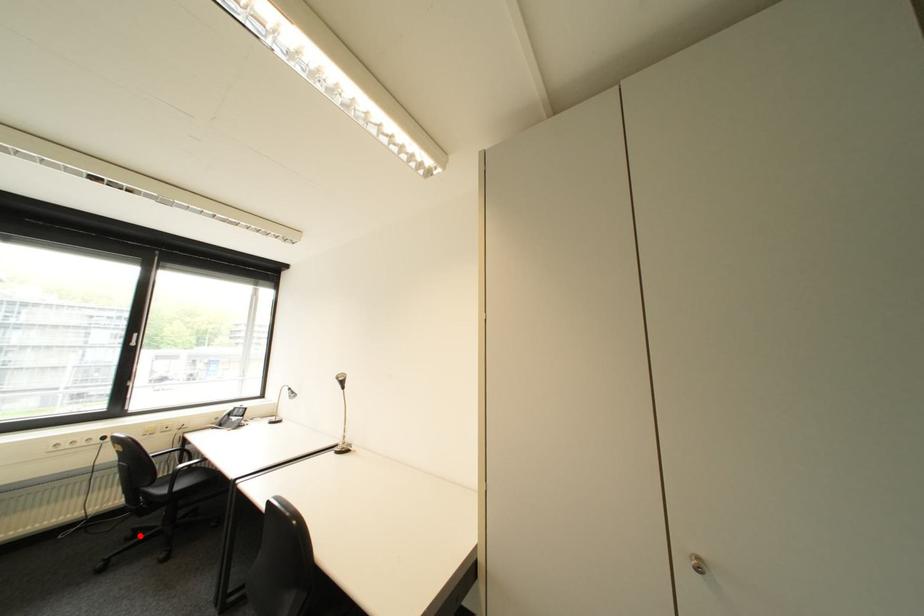
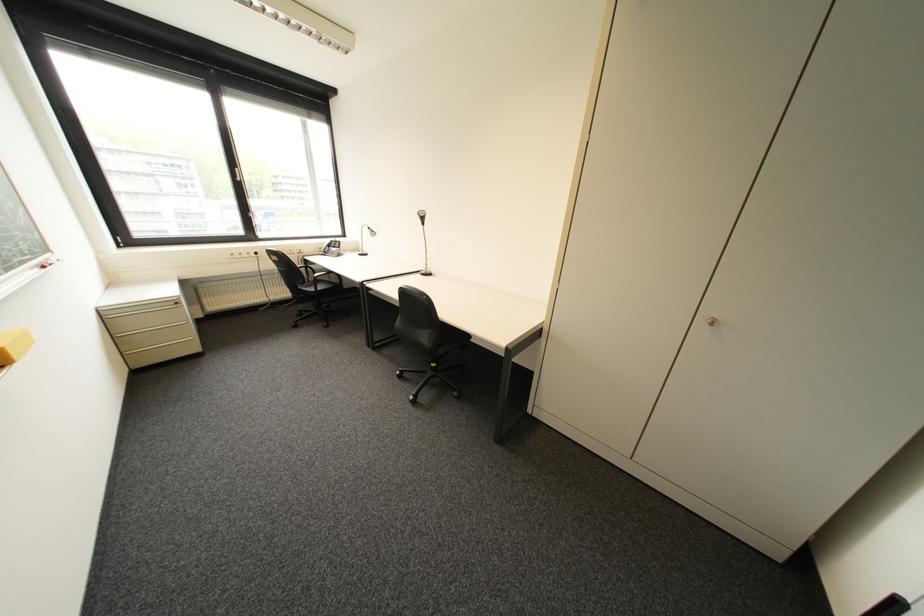
In the second image, find the point that corresponds to the highlighted location in the first image.

(309, 314)